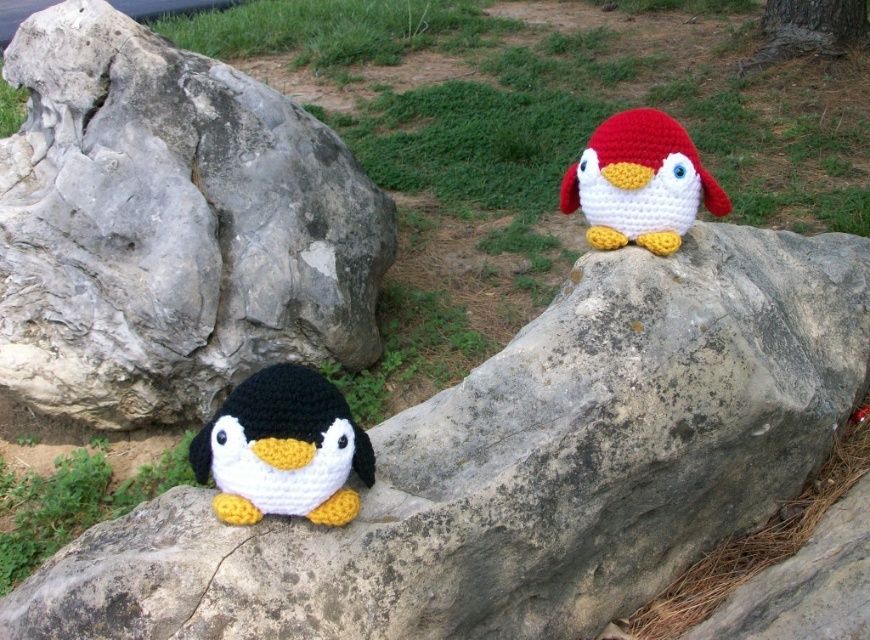
Which is in front, point (252, 566) or point (619, 140)?

Point (252, 566) is in front.

Which is above, gray rough rock at center or red yarn penguin at upper right?

red yarn penguin at upper right

Between point (514, 611) and point (621, 157), which one is positioned in front?

Point (514, 611) is more forward.

Image resolution: width=870 pixels, height=640 pixels. Find the location of `gray rough rock at center`. gray rough rock at center is located at coordinates (522, 467).

Is gray rough rock at center shorter than gray rough boulder at lower left?

Correct, gray rough rock at center is not as tall as gray rough boulder at lower left.

Is gray rough rock at center further to camera compared to gray rough boulder at lower left?

No, it is not.

Find the location of a particular element. The image size is (870, 640). gray rough rock at center is located at coordinates click(522, 467).

Does black yarn penguin at lower left appear under red yarn penguin at upper right?

Yes, black yarn penguin at lower left is below red yarn penguin at upper right.

Does point (286, 380) come closer to viewer compared to point (688, 204)?

Yes, point (286, 380) is closer to viewer.

Locate an element on the screen. This screenshot has height=640, width=870. black yarn penguin at lower left is located at coordinates (283, 449).

Identify the location of black yarn penguin at lower left. This screenshot has height=640, width=870. (283, 449).